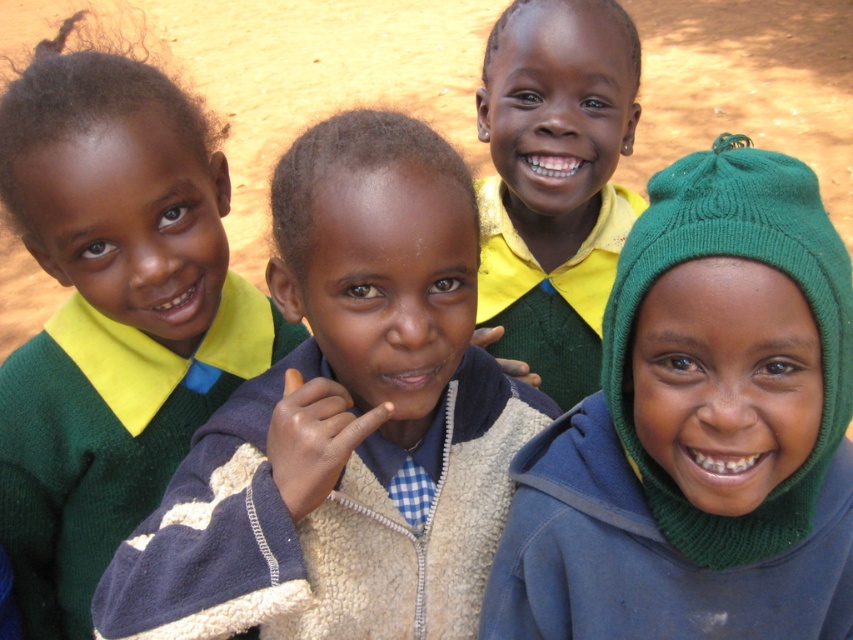
You are a photographer trying to capture a group photo of the children. You need to ensure that the green knitted hat at upper right and the matte yellow shirt at center are both clearly visible in the frame. Given their distance apart, will you be able to adjust the camera to include both in the shot?

The green knitted hat at upper right is 20.22 inches away from the matte yellow shirt at center. Since this distance is relatively small, adjusting the camera angle or zoom should allow both to be captured clearly in the frame.

You are a photographer trying to frame a shot that includes both the green knitted hat at upper right and the matte yellow shirt at center. Which object should you adjust your camera angle to prioritize in terms of width to ensure both fit within the frame?

The green knitted hat at upper right is wider than the matte yellow shirt at center, so you should prioritize framing for the width of the green knitted hat at upper right to ensure both fit within the frame.

Based on the scene description, where is the green knitted sweater at center located in the image?

The green knitted sweater at center is located at point coordinates of (345, 420).